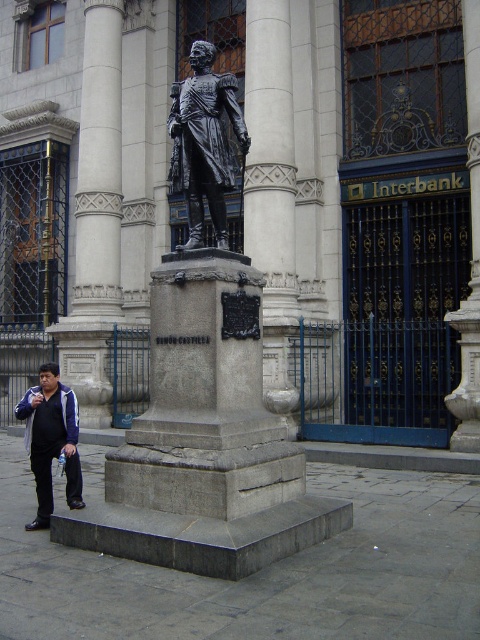
How much distance is there between gray stone column at center and dark blue jacket at lower left?

42.99 feet

The image size is (480, 640). Find the location of `gray stone column at center`. gray stone column at center is located at coordinates (96, 218).

Between gray stone column at center and bronze statue at center, which one appears on the left side from the viewer's perspective?

gray stone column at center is more to the left.

Does gray stone column at center have a larger size compared to bronze statue at center?

Indeed, gray stone column at center has a larger size compared to bronze statue at center.

Is point (88, 148) behind point (188, 96)?

Yes.

Locate an element on the screen. The image size is (480, 640). gray stone column at center is located at coordinates (96, 218).

Does polished bronze pillar at center have a larger size compared to dark blue jacket at lower left?

Correct, polished bronze pillar at center is larger in size than dark blue jacket at lower left.

What do you see at coordinates (471, 253) in the screenshot? I see `polished bronze pillar at center` at bounding box center [471, 253].

Where is `polished bronze pillar at center`? The width and height of the screenshot is (480, 640). polished bronze pillar at center is located at coordinates (471, 253).